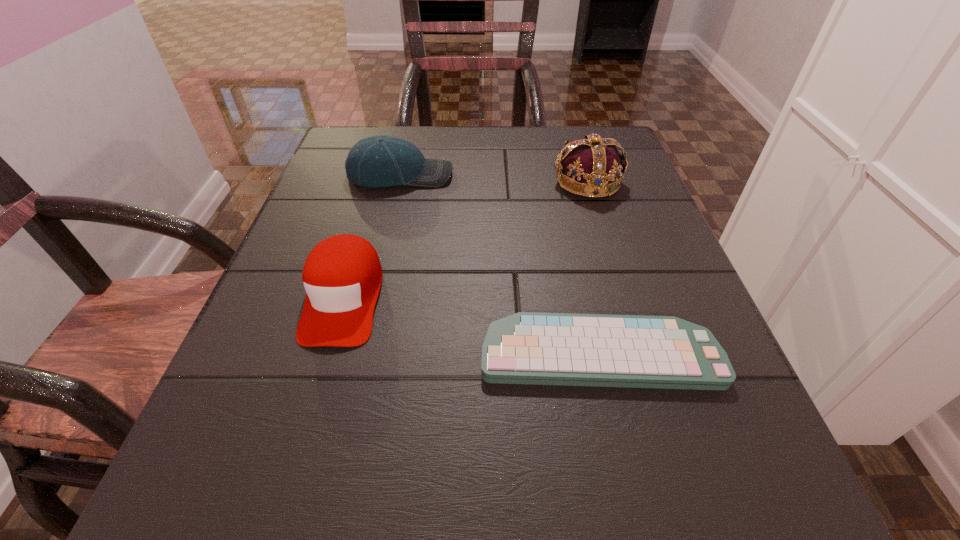
Locate an element on the screen. crown is located at coordinates (593, 167).

Where is `the nearer baseball cap`? This screenshot has height=540, width=960. the nearer baseball cap is located at coordinates (342, 275).

This screenshot has height=540, width=960. I want to click on the farther baseball cap, so click(x=379, y=161).

You are a GUI agent. You are given a task and a screenshot of the screen. Output one action in this format:
    pyautogui.click(x=<x>, y=<y>)
    Task: Click on the shortest object
    
    Given the screenshot: What is the action you would take?
    pyautogui.click(x=636, y=351)

Where is `vacant area situated on the left of the crown`? Image resolution: width=960 pixels, height=540 pixels. vacant area situated on the left of the crown is located at coordinates [374, 181].

You are a GUI agent. You are given a task and a screenshot of the screen. Output one action in this format:
    pyautogui.click(x=<x>, y=<y>)
    Task: Click on the vacant space located on the front-facing side of the nearer baseball cap
    This screenshot has height=540, width=960.
    Given the screenshot: What is the action you would take?
    [x=298, y=453]

Find the location of a particular element. vacant space situated 0.310m on the front of the farther baseball cap is located at coordinates (370, 302).

This screenshot has width=960, height=540. Find the location of `vacant space located 0.260m on the left of the computer keyboard`. vacant space located 0.260m on the left of the computer keyboard is located at coordinates pyautogui.click(x=300, y=354).

You are a GUI agent. You are given a task and a screenshot of the screen. Output one action in this format:
    pyautogui.click(x=<x>, y=<y>)
    Task: Click on the crown present at the far edge
    The image size is (960, 540).
    Given the screenshot: What is the action you would take?
    pyautogui.click(x=593, y=167)

Locate an element on the screen. baseball cap that is at the far edge is located at coordinates (379, 161).